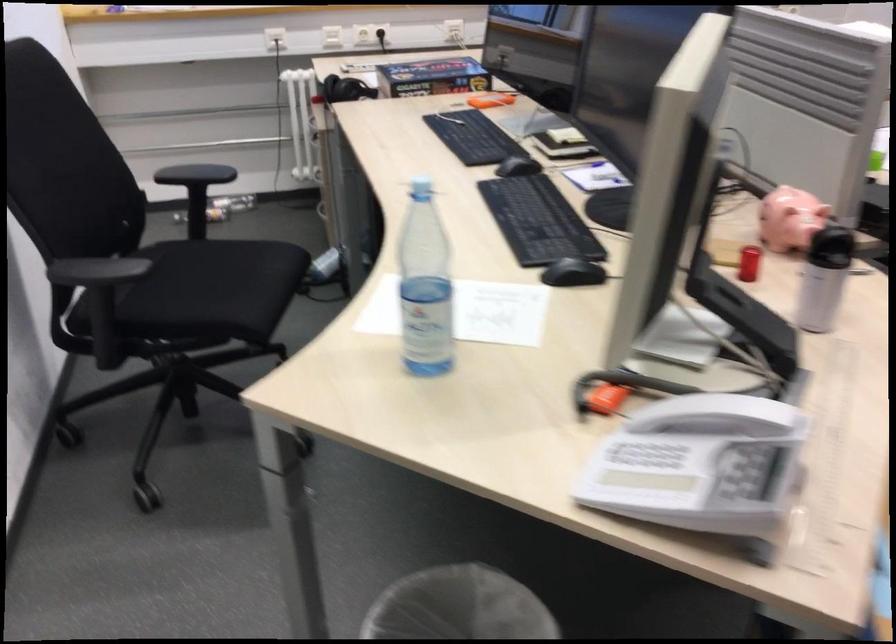
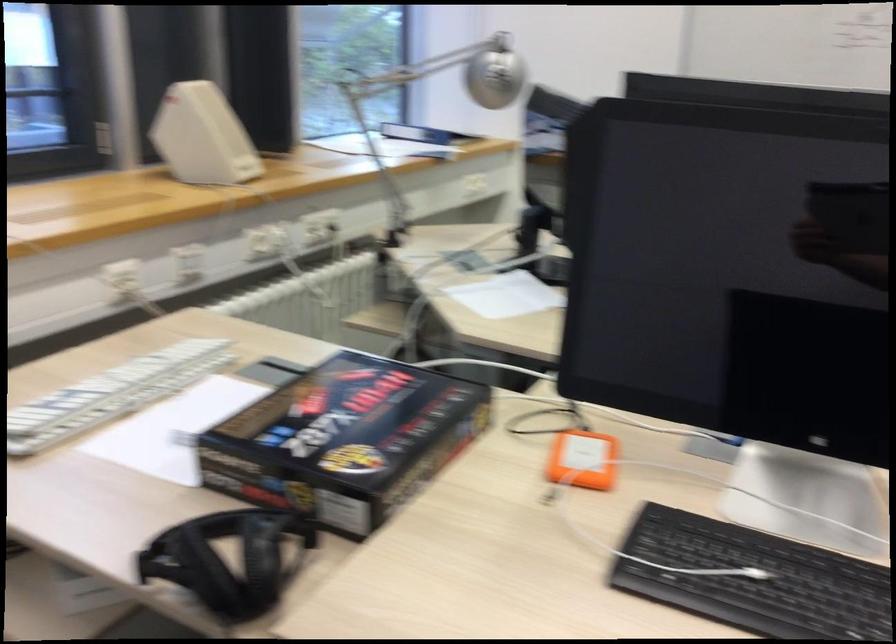
The point at (479, 99) is marked in the first image. Where is the corresponding point in the second image?

(582, 460)